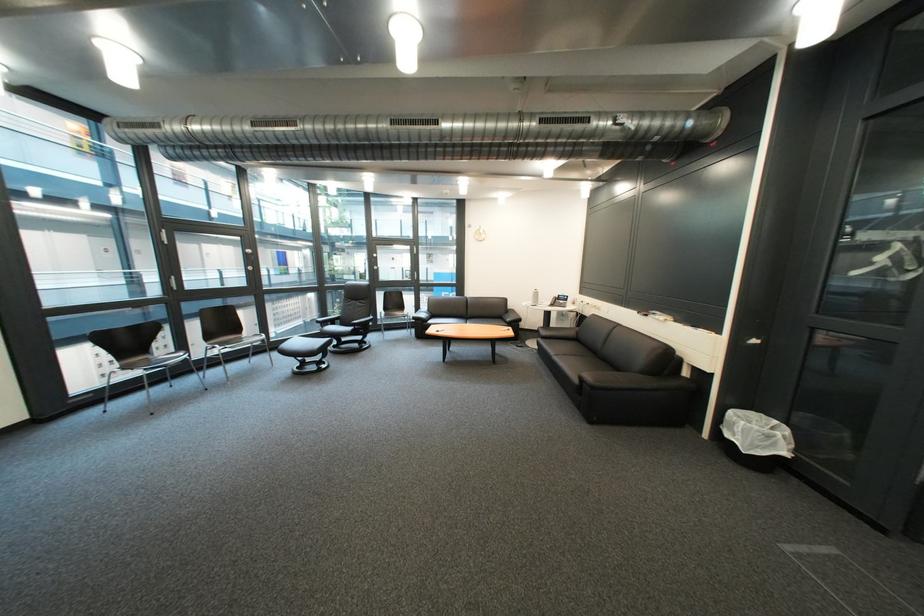
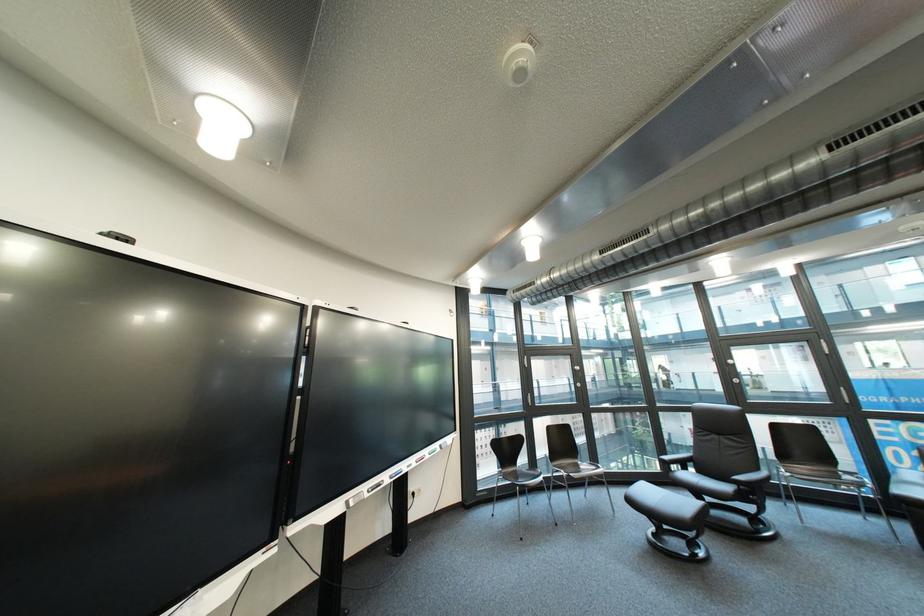
Based on the continuous images, in which direction is the camera rotating?

The camera rotated toward left-up.